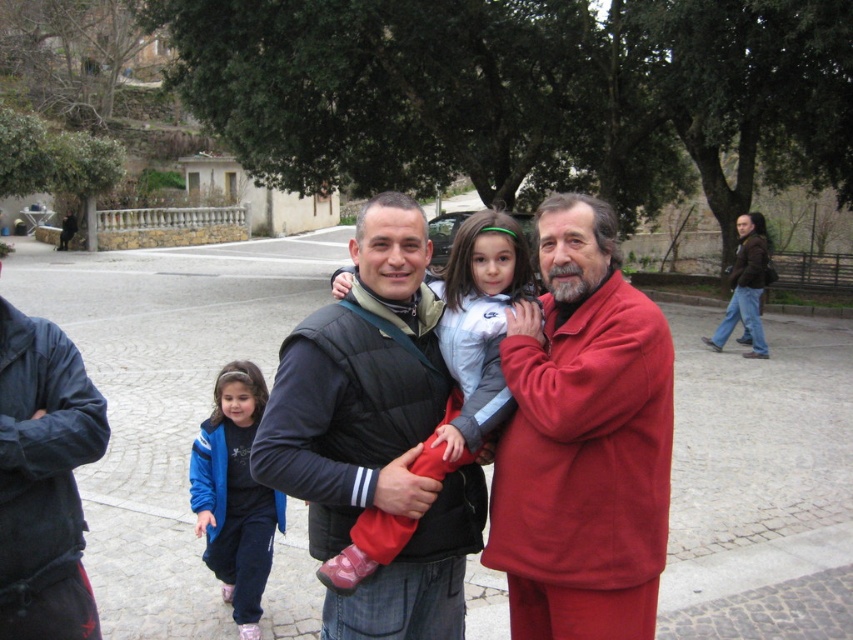
Question: Considering the relative positions of matte red jacket at center and black quilted vest at center in the image provided, where is matte red jacket at center located with respect to black quilted vest at center?

Choices:
 (A) below
 (B) above

Answer: (A)

Question: Which object appears closest to the camera in this image?

Choices:
 (A) matte red jacket at center
 (B) blue fleece jacket at lower left

Answer: (A)

Question: Which of the following is the closest to the observer?

Choices:
 (A) matte red jacket at center
 (B) dark blue corduroy jacket at left

Answer: (B)

Question: Where is dark blue corduroy jacket at left located in relation to blue fleece jacket at lower left in the image?

Choices:
 (A) above
 (B) below

Answer: (A)

Question: Which point is closer to the camera?

Choices:
 (A) (86, 582)
 (B) (428, 428)

Answer: (A)

Question: Is dark blue corduroy jacket at left further to the viewer compared to blue fleece jacket at lower left?

Choices:
 (A) yes
 (B) no

Answer: (B)